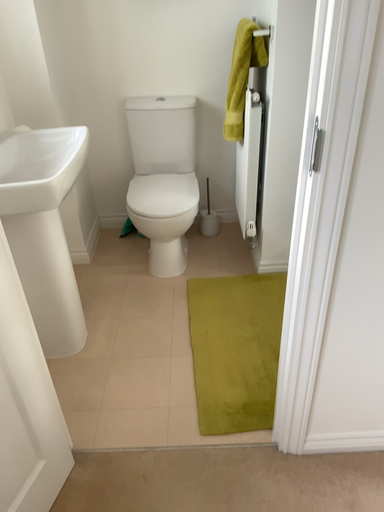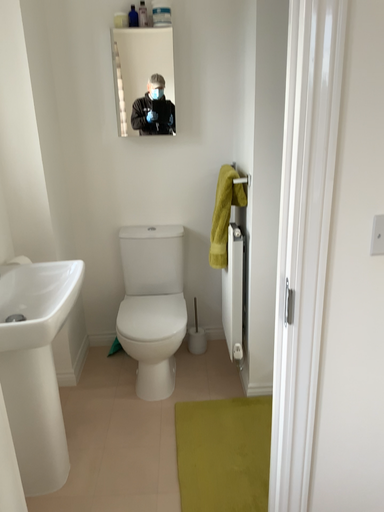
Question: How did the camera likely rotate when shooting the video?

Choices:
 (A) rotated upward
 (B) rotated downward

Answer: (A)